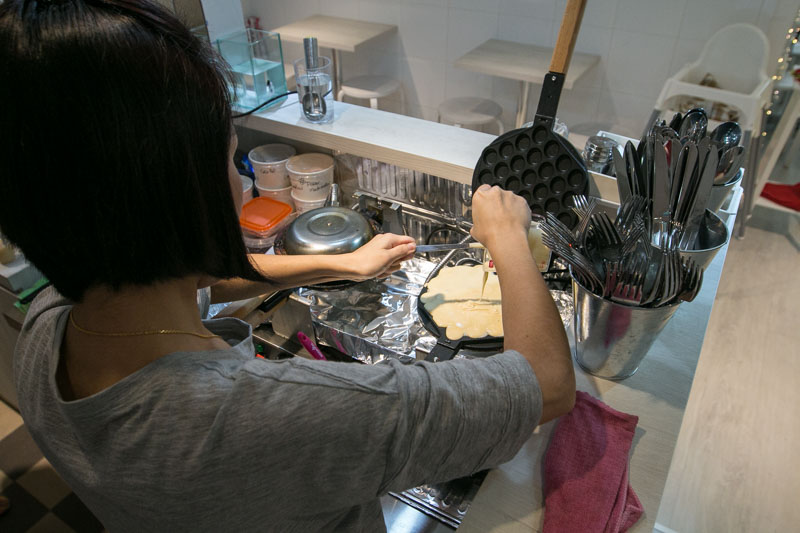
Locate an element on the screen. high chair is located at coordinates (736, 77).